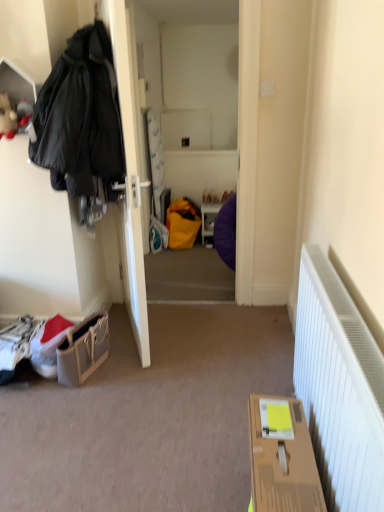
Question: Is matte purple bean bag at center placed right next to fluffy plush toy at upper left?

Choices:
 (A) yes
 (B) no

Answer: (B)

Question: Is matte purple bean bag at center positioned far away from fluffy plush toy at upper left?

Choices:
 (A) no
 (B) yes

Answer: (B)

Question: Does matte purple bean bag at center have a greater height compared to fluffy plush toy at upper left?

Choices:
 (A) yes
 (B) no

Answer: (A)

Question: Can you confirm if matte purple bean bag at center is positioned to the left of fluffy plush toy at upper left?

Choices:
 (A) no
 (B) yes

Answer: (A)

Question: From a real-world perspective, is matte purple bean bag at center under fluffy plush toy at upper left?

Choices:
 (A) no
 (B) yes

Answer: (B)

Question: From the image's perspective, is matte purple bean bag at center located above fluffy plush toy at upper left?

Choices:
 (A) no
 (B) yes

Answer: (A)

Question: Could you tell me if leather textured handbag at lower left is turned towards cardboard box at lower right?

Choices:
 (A) yes
 (B) no

Answer: (B)

Question: Considering the relative sizes of leather textured handbag at lower left and cardboard box at lower right in the image provided, is leather textured handbag at lower left bigger than cardboard box at lower right?

Choices:
 (A) yes
 (B) no

Answer: (B)

Question: Is leather textured handbag at lower left turned away from cardboard box at lower right?

Choices:
 (A) yes
 (B) no

Answer: (B)

Question: Considering the relative positions of leather textured handbag at lower left and cardboard box at lower right in the image provided, is leather textured handbag at lower left to the right of cardboard box at lower right from the viewer's perspective?

Choices:
 (A) yes
 (B) no

Answer: (B)

Question: Can you confirm if leather textured handbag at lower left is positioned to the left of cardboard box at lower right?

Choices:
 (A) yes
 (B) no

Answer: (A)

Question: Is leather textured handbag at lower left closer to camera compared to cardboard box at lower right?

Choices:
 (A) yes
 (B) no

Answer: (B)

Question: Does matte white door at left turn towards matte purple bean bag at center?

Choices:
 (A) no
 (B) yes

Answer: (B)